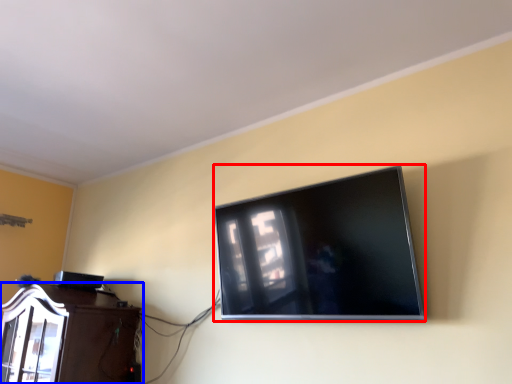
Question: Which object appears closest to the camera in this image, television (highlighted by a red box) or furniture (highlighted by a blue box)?

Choices:
 (A) television
 (B) furniture

Answer: (A)